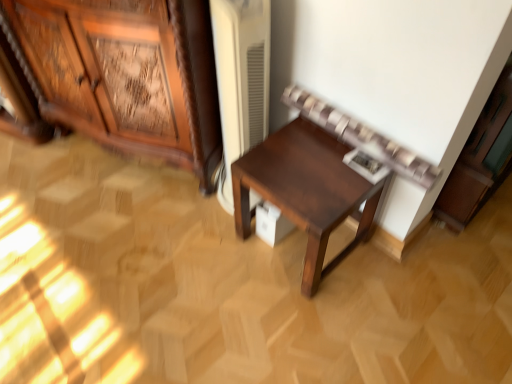
You are a GUI agent. You are given a task and a screenshot of the screen. Output one action in this format:
    pyautogui.click(x=<x>, y=<y>)
    Task: Click on the blank space to the left of dark wood table at center
    This screenshot has width=512, height=384.
    Given the screenshot: What is the action you would take?
    pyautogui.click(x=211, y=254)